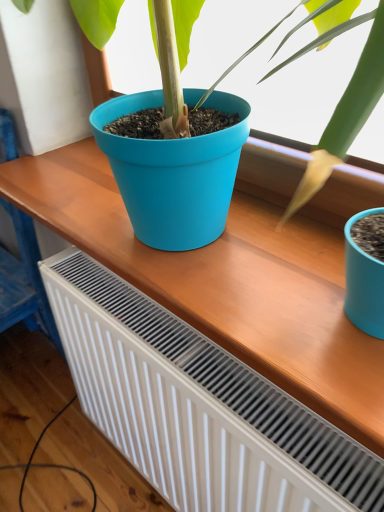
Identify the location of matte plastic pot at center. (358, 94).

What do you see at coordinates (358, 94) in the screenshot?
I see `matte plastic pot at center` at bounding box center [358, 94].

Find the location of `matte plastic pot at center`. matte plastic pot at center is located at coordinates (358, 94).